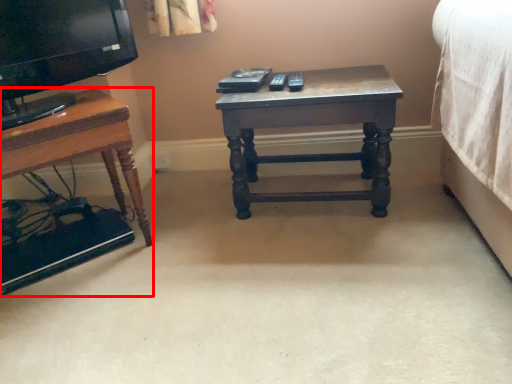
Question: From the image's perspective, where is table (annotated by the red box) located relative to table?

Choices:
 (A) below
 (B) above

Answer: (A)